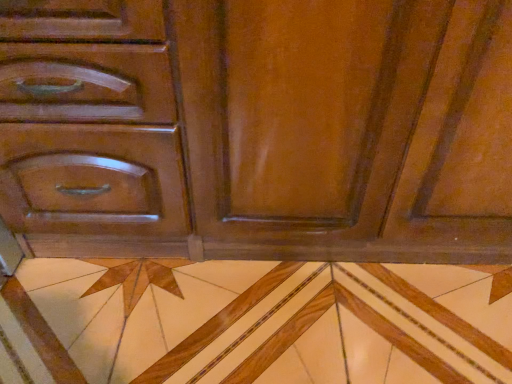
Locate an element on the screen. This screenshot has width=512, height=384. wooden parquet floor at center is located at coordinates (254, 323).

In order to face wooden parquet floor at center, should I rotate leftwards or rightwards?

Rotate right and turn 0.405 degrees.

Describe the element at coordinates (254, 323) in the screenshot. The height and width of the screenshot is (384, 512). I see `wooden parquet floor at center` at that location.

In order to click on wooden parquet floor at center in this screenshot , I will do `click(254, 323)`.